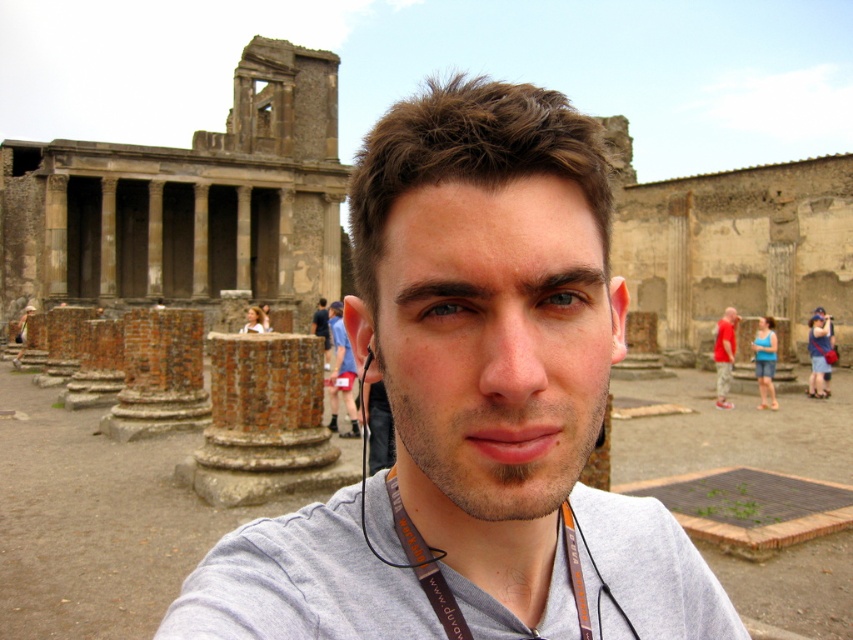
Question: Is gray fabric shirt at center positioned in front of blue fabric shorts at center?

Choices:
 (A) no
 (B) yes

Answer: (B)

Question: From the image, what is the correct spatial relationship of gray fabric shirt at center in relation to gray fabric at center?

Choices:
 (A) right
 (B) left

Answer: (A)

Question: Which object appears closest to the camera in this image?

Choices:
 (A) gray fabric shirt at center
 (B) gray fabric at center

Answer: (B)

Question: Is the position of gray fabric shirt at center less distant than that of blue fabric shorts at center?

Choices:
 (A) yes
 (B) no

Answer: (A)

Question: Among these points, which one is farthest from the camera?

Choices:
 (A) (668, 522)
 (B) (717, 380)

Answer: (B)

Question: Which of the following is the farthest from the observer?

Choices:
 (A) gray fabric shirt at center
 (B) gray fabric at center
 (C) red cotton shirt at right

Answer: (C)